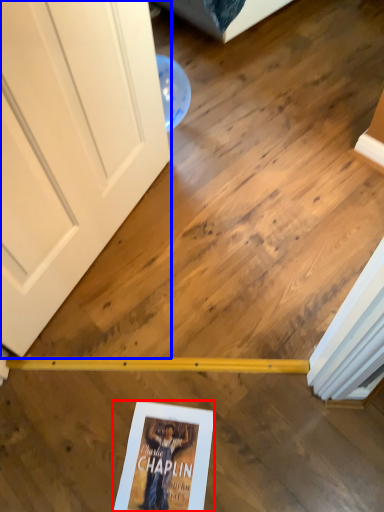
Question: Among these objects, which one is nearest to the camera, paperback book (highlighted by a red box) or door (highlighted by a blue box)?

Choices:
 (A) paperback book
 (B) door

Answer: (B)